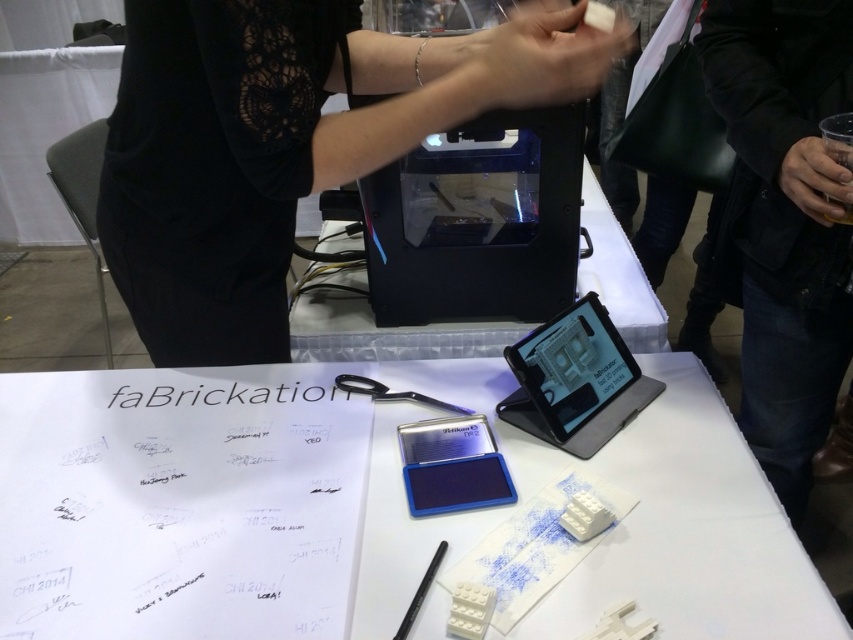
This screenshot has width=853, height=640. Describe the element at coordinates (479, 220) in the screenshot. I see `black plastic printer at center` at that location.

Can you confirm if black plastic printer at center is positioned below metallic scissors at center?

Incorrect, black plastic printer at center is not positioned below metallic scissors at center.

Where is `black plastic printer at center`? This screenshot has width=853, height=640. black plastic printer at center is located at coordinates (479, 220).

Consider the image. Can you confirm if brown leather jacket at upper right is shorter than matte black tablet at center?

Incorrect, brown leather jacket at upper right's height does not fall short of matte black tablet at center's.

Is brown leather jacket at upper right behind matte black tablet at center?

No.

Where is `brown leather jacket at upper right`? Image resolution: width=853 pixels, height=640 pixels. brown leather jacket at upper right is located at coordinates [785, 220].

Where is `brown leather jacket at upper right`? The height and width of the screenshot is (640, 853). brown leather jacket at upper right is located at coordinates (785, 220).

Is transparent plastic printer at center to the right of metallic scissors at center from the viewer's perspective?

Yes, transparent plastic printer at center is to the right of metallic scissors at center.

Who is higher up, transparent plastic printer at center or metallic scissors at center?

Positioned higher is transparent plastic printer at center.

Who is more forward, (405,355) or (352,388)?

Point (352,388)

This screenshot has width=853, height=640. I want to click on transparent plastic printer at center, so click(390, 333).